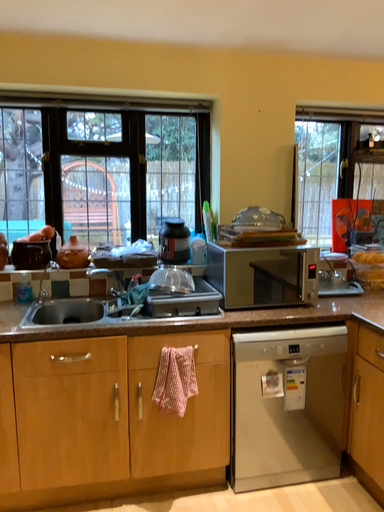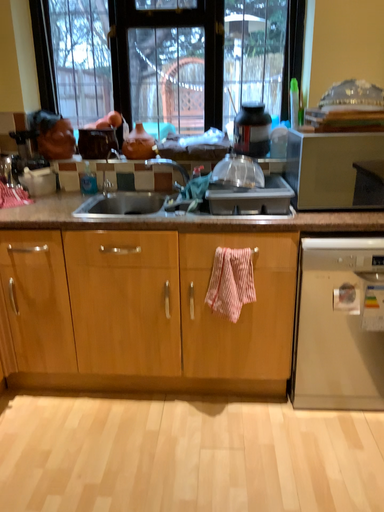
Question: How did the camera likely rotate when shooting the video?

Choices:
 (A) rotated upward
 (B) rotated downward

Answer: (B)